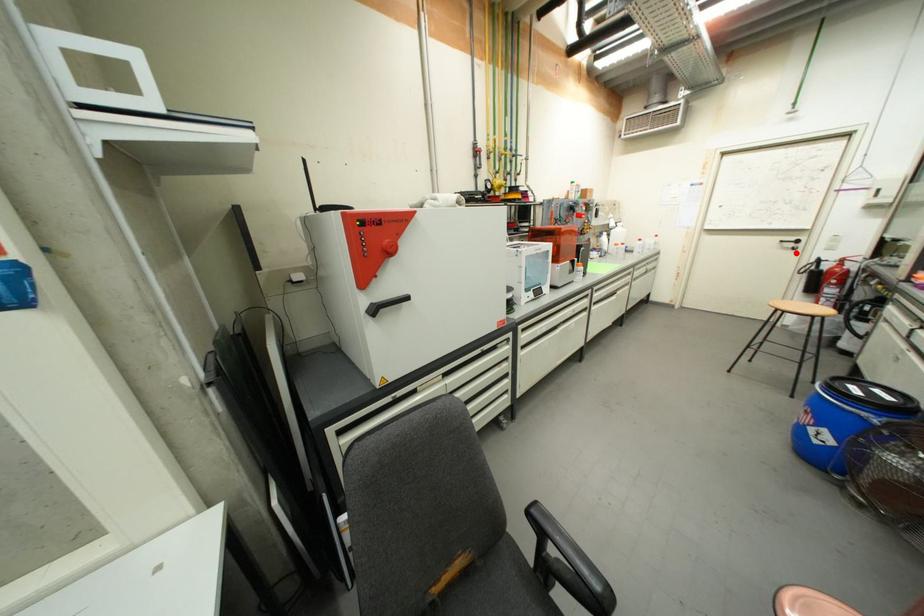
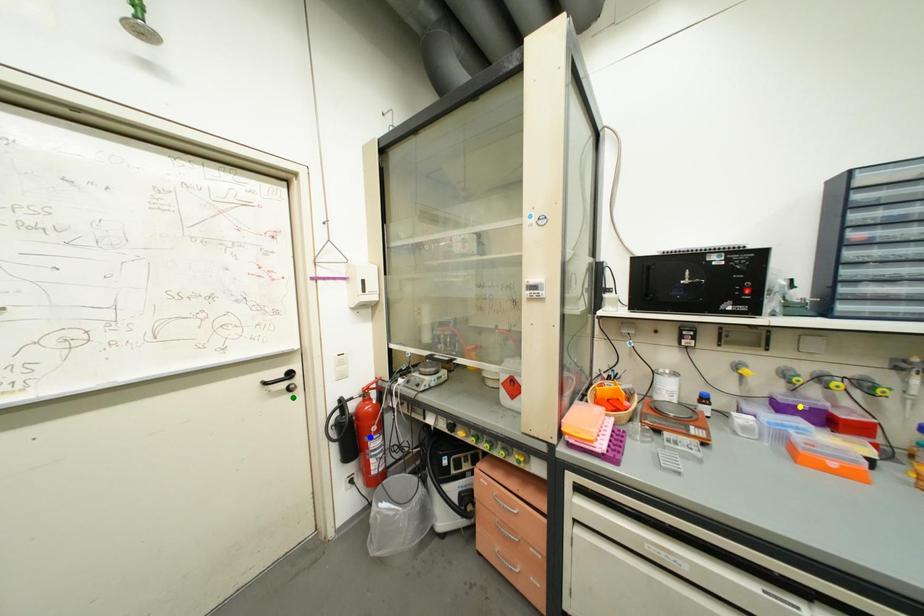
Question: I am providing you with two images of the same scene from different viewpoints. A red point is marked on the first image. You are given multiple points on the second image. Which spot in image 2 lines up with the point in image 1?

Choices:
 (A) yellow point
 (B) green point
 (C) blue point

Answer: (B)